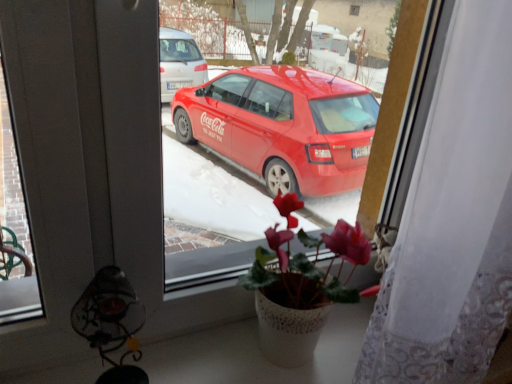
This screenshot has height=384, width=512. I want to click on vacant region to the right of pink matte cyclamen at center, so click(346, 340).